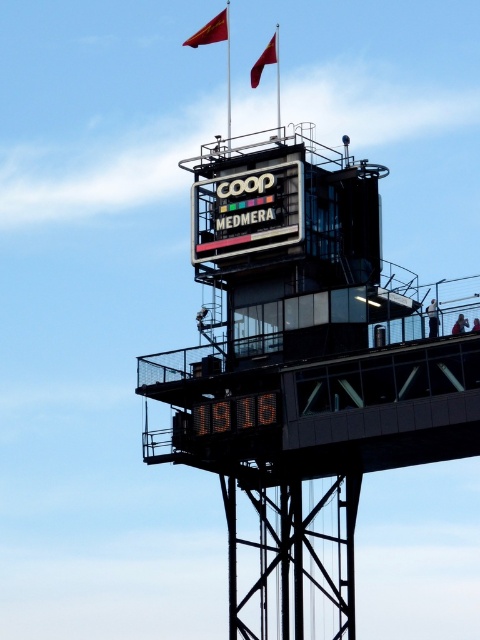
You are standing at the base of the industrial structure and want to know how far the point marked at coordinates point (256, 221) is from you. Can you determine the distance?

The distance between point (256, 221) and the viewer is 112.80 meters.

You are standing at the base of the structure and want to locate the red fabric flag at upper center. According to the scene, which direction should you look relative to the black glossy signboard at center?

The black glossy signboard at center is to the right of the red fabric flag at upper center, so you should look to the left of the black glossy signboard at center to find the red fabric flag at upper center.

Consider the image. You are standing at the base of the industrial structure and want to locate the digital orange numbers at center. According to the scene description, where should you look relative to the COOP sign?

The digital orange numbers at center are located at point coordinates of [235,413], which places them slightly to the right and just below the COOP sign.